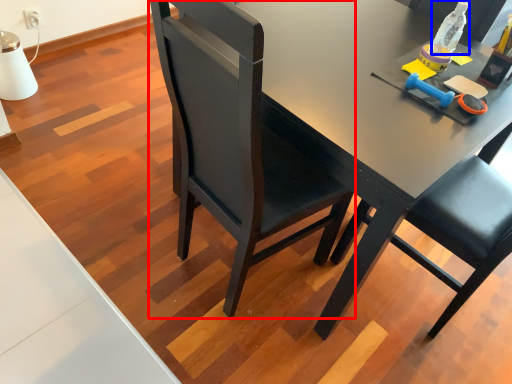
Question: Which point is closer to the camera, chair (highlighted by a red box) or bottle (highlighted by a blue box)?

Choices:
 (A) chair
 (B) bottle

Answer: (A)